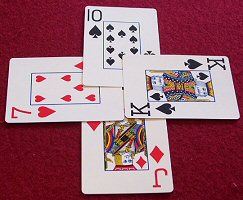
This screenshot has height=200, width=243. I want to click on playing cards face up, so click(114, 80), click(134, 84), click(108, 109), click(94, 140).